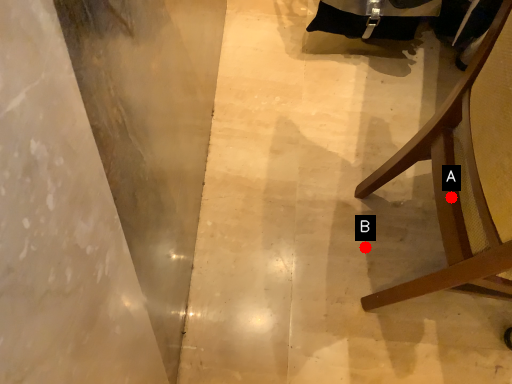
Question: Two points are circled on the image, labeled by A and B beside each circle. Which point is closer to the camera?

Choices:
 (A) A is closer
 (B) B is closer

Answer: (A)